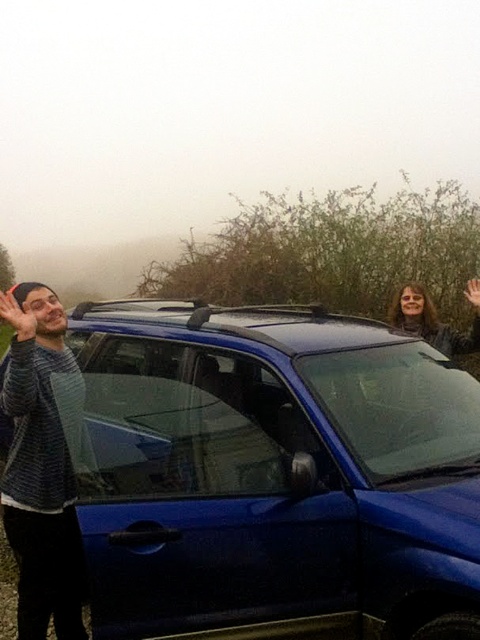
You are a photographer trying to capture a clear photo of the blue glossy suv at center and the matte black hair at upper right. Which object should you focus on first to ensure it appears sharp in the photo?

The blue glossy suv at center is taller than the matte black hair at upper right, so you should focus on the blue glossy suv at center first to ensure it appears sharp in the photo.